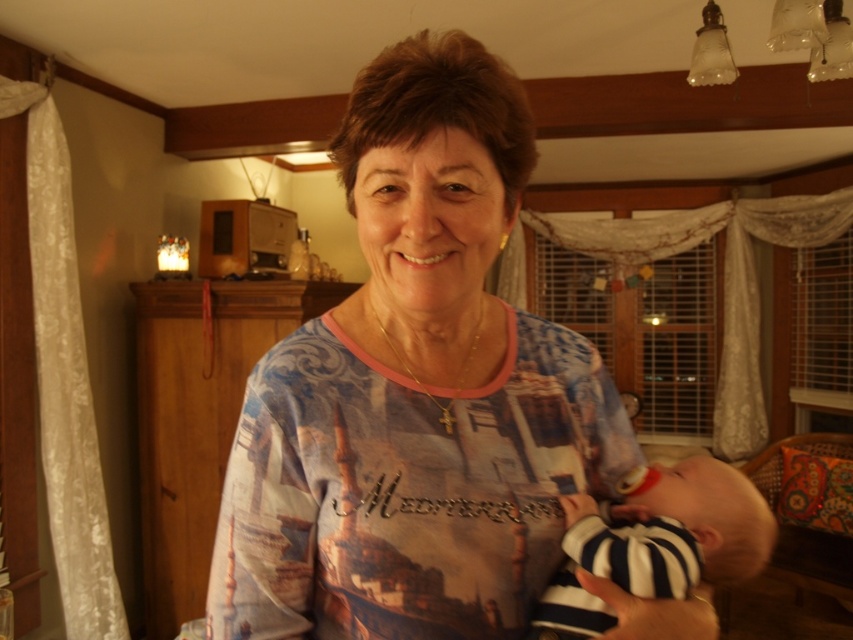
Measure the distance between blue printed shirt at center and striped cotton onesie at center.

blue printed shirt at center and striped cotton onesie at center are 5.76 inches apart from each other.

Between blue printed shirt at center and striped cotton onesie at center, which one has more height?

blue printed shirt at center

Who is more forward, (352, 177) or (672, 508)?

Point (352, 177)

I want to click on blue printed shirt at center, so click(415, 392).